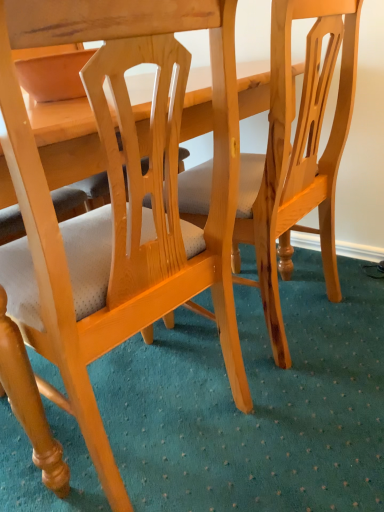
What do you see at coordinates (297, 153) in the screenshot? This screenshot has width=384, height=512. I see `light brown wood chair at center, which ranks as the 1th chair in right-to-left order` at bounding box center [297, 153].

Find the location of `light brown wood chair at center, which ranks as the 1th chair in right-to-left order`. light brown wood chair at center, which ranks as the 1th chair in right-to-left order is located at coordinates (297, 153).

What is the approximate width of light brown wood chair at center, which ranks as the 1th chair in right-to-left order?

It is 12.05 inches.

The width and height of the screenshot is (384, 512). What do you see at coordinates (117, 209) in the screenshot? I see `light brown wood chair at center, which ranks as the 2th chair in right-to-left order` at bounding box center [117, 209].

Identify the location of light brown wood chair at center, which is counted as the 1th chair, starting from the left. (117, 209).

At what (x,y) coordinates should I click in order to perform the action: click on light brown wood chair at center, which is counted as the second chair, starting from the left. Please return your answer as a coordinate pair (x, y). Looking at the image, I should click on (297, 153).

Can you confirm if light brown wood chair at center, which ranks as the 1th chair in right-to-left order, is positioned to the right of light brown wood chair at center, which is counted as the 1th chair, starting from the left?

Indeed, light brown wood chair at center, which ranks as the 1th chair in right-to-left order, is positioned on the right side of light brown wood chair at center, which is counted as the 1th chair, starting from the left.

Is the depth of light brown wood chair at center, which ranks as the 1th chair in right-to-left order, less than that of light brown wood chair at center, which ranks as the 2th chair in right-to-left order?

No, it is behind light brown wood chair at center, which ranks as the 2th chair in right-to-left order.

Is point (260, 275) more distant than point (35, 156)?

Yes, it is behind point (35, 156).

From the image's perspective, is light brown wood chair at center, which ranks as the 1th chair in right-to-left order, below light brown wood chair at center, which ranks as the 2th chair in right-to-left order?

Actually, light brown wood chair at center, which ranks as the 1th chair in right-to-left order, appears above light brown wood chair at center, which ranks as the 2th chair in right-to-left order, in the image.

From a real-world perspective, is light brown wood chair at center, which is counted as the second chair, starting from the left, over light brown wood chair at center, which is counted as the 1th chair, starting from the left?

No.

Which of these two, light brown wood chair at center, which is counted as the second chair, starting from the left, or light brown wood chair at center, which is counted as the 1th chair, starting from the left, is wider?

light brown wood chair at center, which is counted as the 1th chair, starting from the left.

Between light brown wood chair at center, which ranks as the 1th chair in right-to-left order, and light brown wood chair at center, which ranks as the 2th chair in right-to-left order, which one has more height?

With more height is light brown wood chair at center, which ranks as the 2th chair in right-to-left order.

Considering the relative sizes of light brown wood chair at center, which ranks as the 1th chair in right-to-left order, and light brown wood chair at center, which is counted as the 1th chair, starting from the left, in the image provided, is light brown wood chair at center, which ranks as the 1th chair in right-to-left order, bigger than light brown wood chair at center, which is counted as the 1th chair, starting from the left,?

No.

Is light brown wood chair at center, which is counted as the second chair, starting from the left, not inside light brown wood chair at center, which ranks as the 2th chair in right-to-left order?

That's correct, light brown wood chair at center, which is counted as the second chair, starting from the left, is outside of light brown wood chair at center, which ranks as the 2th chair in right-to-left order.

Is light brown wood chair at center, which is counted as the second chair, starting from the left, far from light brown wood chair at center, which is counted as the 1th chair, starting from the left?

No, light brown wood chair at center, which is counted as the second chair, starting from the left, is not far from light brown wood chair at center, which is counted as the 1th chair, starting from the left.

Is light brown wood chair at center, which is counted as the second chair, starting from the left, positioned with its back to light brown wood chair at center, which is counted as the 1th chair, starting from the left?

That's not correct — light brown wood chair at center, which is counted as the second chair, starting from the left, is not looking away from light brown wood chair at center, which is counted as the 1th chair, starting from the left.

Identify the location of chair below the light brown wood chair at center, which ranks as the 2th chair in right-to-left order (from a real-world perspective). This screenshot has height=512, width=384. (297, 153).

Is light brown wood chair at center, which is counted as the 1th chair, starting from the left, at the right side of light brown wood chair at center, which ranks as the 1th chair in right-to-left order?

Incorrect, light brown wood chair at center, which is counted as the 1th chair, starting from the left, is not on the right side of light brown wood chair at center, which ranks as the 1th chair in right-to-left order.

Which object is further away from the camera, light brown wood chair at center, which ranks as the 2th chair in right-to-left order, or light brown wood chair at center, which ranks as the 1th chair in right-to-left order?

light brown wood chair at center, which ranks as the 1th chair in right-to-left order, is further from the camera.

Is point (94, 240) positioned after point (258, 265)?

No, it is not.

From the image's perspective, which one is positioned higher, light brown wood chair at center, which is counted as the 1th chair, starting from the left, or light brown wood chair at center, which is counted as the second chair, starting from the left?

From the image's view, light brown wood chair at center, which is counted as the second chair, starting from the left, is above.

From a real-world perspective, relative to light brown wood chair at center, which is counted as the second chair, starting from the left, is light brown wood chair at center, which ranks as the 2th chair in right-to-left order, vertically above or below?

In terms of real-world spatial position, light brown wood chair at center, which ranks as the 2th chair in right-to-left order, is above light brown wood chair at center, which is counted as the second chair, starting from the left.

Considering the relative sizes of light brown wood chair at center, which is counted as the 1th chair, starting from the left, and light brown wood chair at center, which ranks as the 1th chair in right-to-left order, in the image provided, is light brown wood chair at center, which is counted as the 1th chair, starting from the left, wider than light brown wood chair at center, which ranks as the 1th chair in right-to-left order,?

Yes, light brown wood chair at center, which is counted as the 1th chair, starting from the left, is wider than light brown wood chair at center, which ranks as the 1th chair in right-to-left order.

Is light brown wood chair at center, which ranks as the 2th chair in right-to-left order, taller than light brown wood chair at center, which ranks as the 1th chair in right-to-left order?

Yes, light brown wood chair at center, which ranks as the 2th chair in right-to-left order, is taller than light brown wood chair at center, which ranks as the 1th chair in right-to-left order.

Is light brown wood chair at center, which ranks as the 2th chair in right-to-left order, bigger or smaller than light brown wood chair at center, which ranks as the 1th chair in right-to-left order?

Considering their sizes, light brown wood chair at center, which ranks as the 2th chair in right-to-left order, takes up more space than light brown wood chair at center, which ranks as the 1th chair in right-to-left order.

Is light brown wood chair at center, which is counted as the 1th chair, starting from the left, spatially inside light brown wood chair at center, which ranks as the 1th chair in right-to-left order, or outside of it?

light brown wood chair at center, which is counted as the 1th chair, starting from the left, is not enclosed by light brown wood chair at center, which ranks as the 1th chair in right-to-left order.

From the picture: Is the surface of light brown wood chair at center, which ranks as the 2th chair in right-to-left order, in direct contact with light brown wood chair at center, which ranks as the 1th chair in right-to-left order?

No, light brown wood chair at center, which ranks as the 2th chair in right-to-left order, is not beside light brown wood chair at center, which ranks as the 1th chair in right-to-left order.

Is light brown wood chair at center, which ranks as the 2th chair in right-to-left order, oriented towards light brown wood chair at center, which is counted as the second chair, starting from the left?

No, light brown wood chair at center, which ranks as the 2th chair in right-to-left order, is not oriented towards light brown wood chair at center, which is counted as the second chair, starting from the left.

What's the angular difference between light brown wood chair at center, which ranks as the 2th chair in right-to-left order, and light brown wood chair at center, which ranks as the 1th chair in right-to-left order,'s facing directions?

The angular difference between light brown wood chair at center, which ranks as the 2th chair in right-to-left order, and light brown wood chair at center, which ranks as the 1th chair in right-to-left order, is 3.21e-05 degrees.

Find the location of a particular element. chair above the light brown wood chair at center, which is counted as the 1th chair, starting from the left (from the image's perspective) is located at coordinates (297, 153).

Locate an element on the screen. The height and width of the screenshot is (512, 384). chair located in front of the light brown wood chair at center, which ranks as the 1th chair in right-to-left order is located at coordinates (117, 209).

Identify the location of chair above the light brown wood chair at center, which is counted as the 1th chair, starting from the left (from the image's perspective). (297, 153).